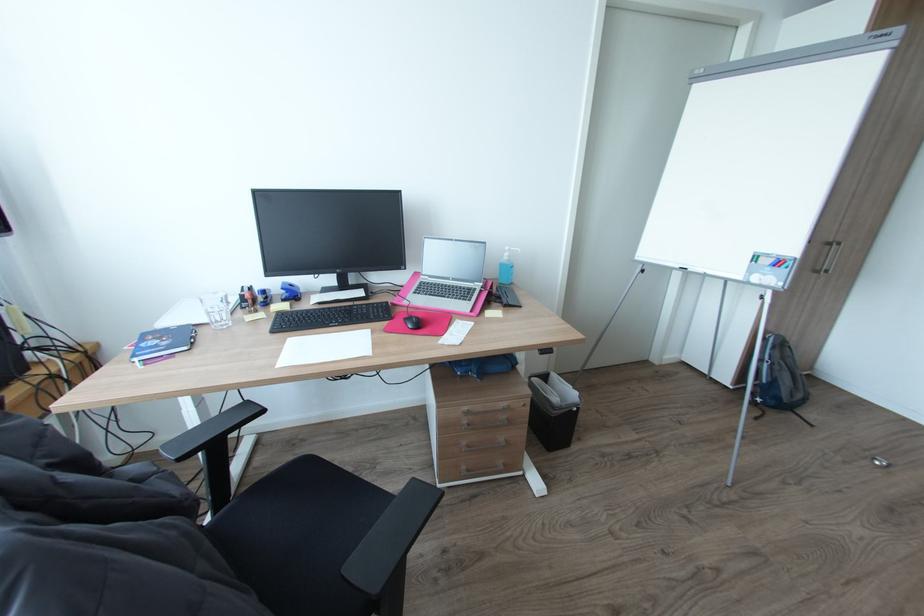
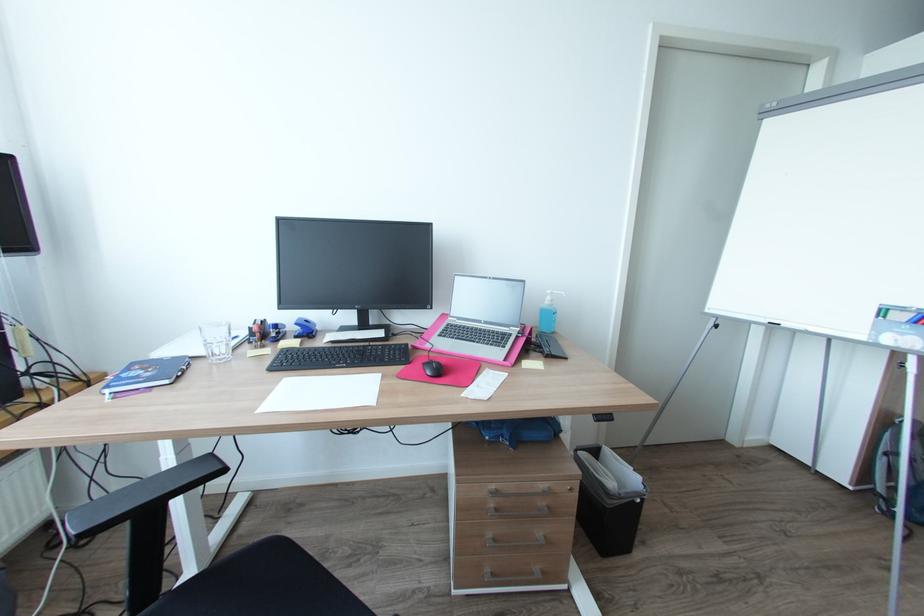
In the second image, find the point that corresponds to point 640,257 in the first image.

(712, 310)